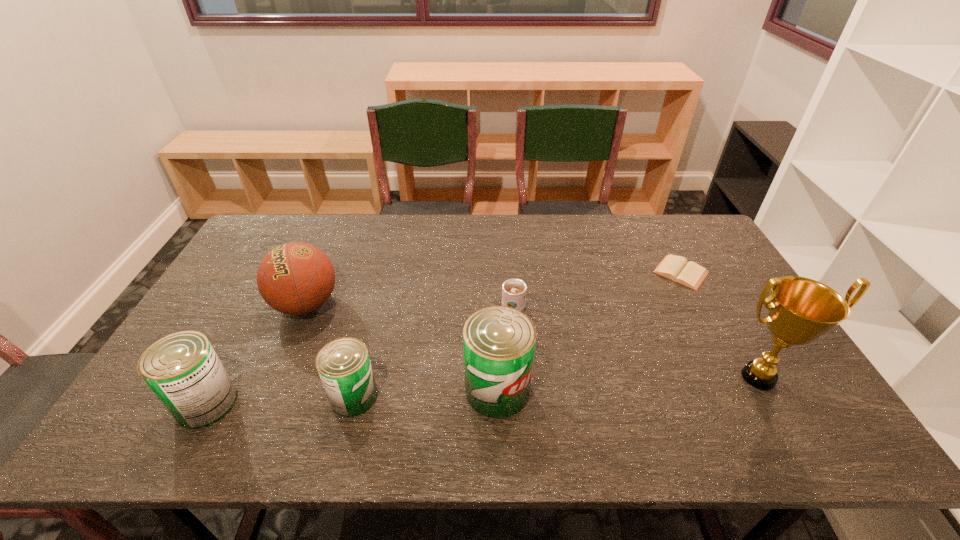
At what (x,y) coordinates should I click in order to perform the action: click on object present at the near left corner. Please return your answer as a coordinate pair (x, y). Looking at the image, I should click on (183, 370).

The image size is (960, 540). I want to click on object that is positioned at the near right corner, so click(800, 310).

Where is `vacant region at the far edge`? The image size is (960, 540). vacant region at the far edge is located at coordinates (605, 220).

Identify the location of vacant space at the left edge of the desktop. The height and width of the screenshot is (540, 960). (258, 311).

The height and width of the screenshot is (540, 960). What are the coordinates of `vacant space at the right edge of the desktop` in the screenshot? It's located at (727, 320).

Identify the location of vacant position at the far right corner of the desktop. (695, 240).

The width and height of the screenshot is (960, 540). In order to click on empty space between the second tallest can and the shortest object in this screenshot , I will do `click(444, 338)`.

Where is `unoccupied area between the shortest can and the award`? Image resolution: width=960 pixels, height=540 pixels. unoccupied area between the shortest can and the award is located at coordinates (556, 387).

I want to click on free space that is in between the shortest object and the leftmost can, so click(x=444, y=338).

At what (x,y) coordinates should I click in order to perform the action: click on vacant area that lies between the cup and the tallest object. Please return your answer as a coordinate pair (x, y). Looking at the image, I should click on (636, 342).